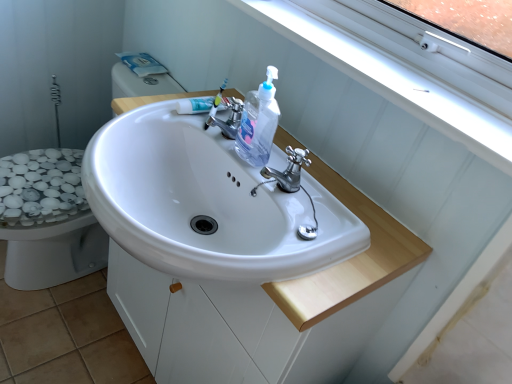
In order to click on free space to the left of clear plastic bottle at center in this screenshot , I will do `click(178, 121)`.